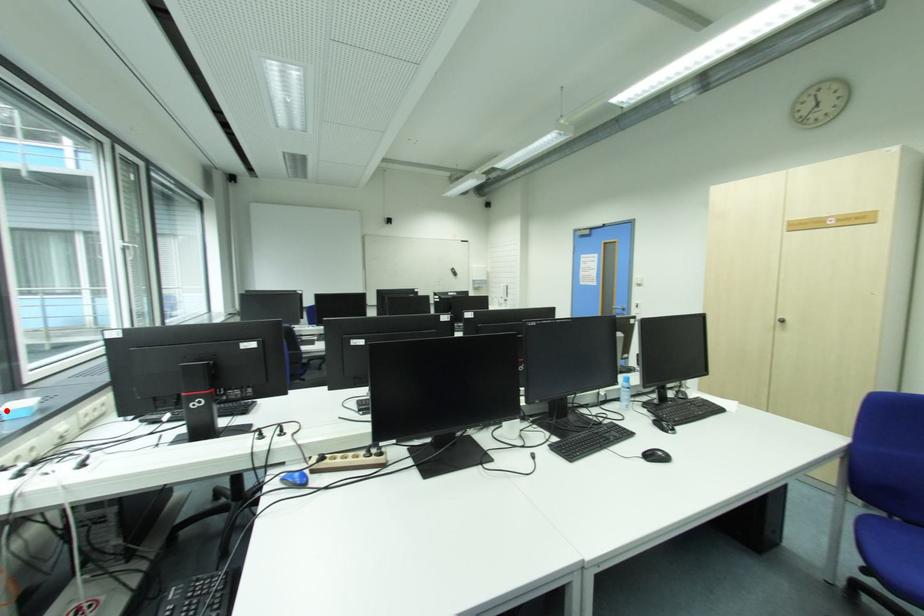
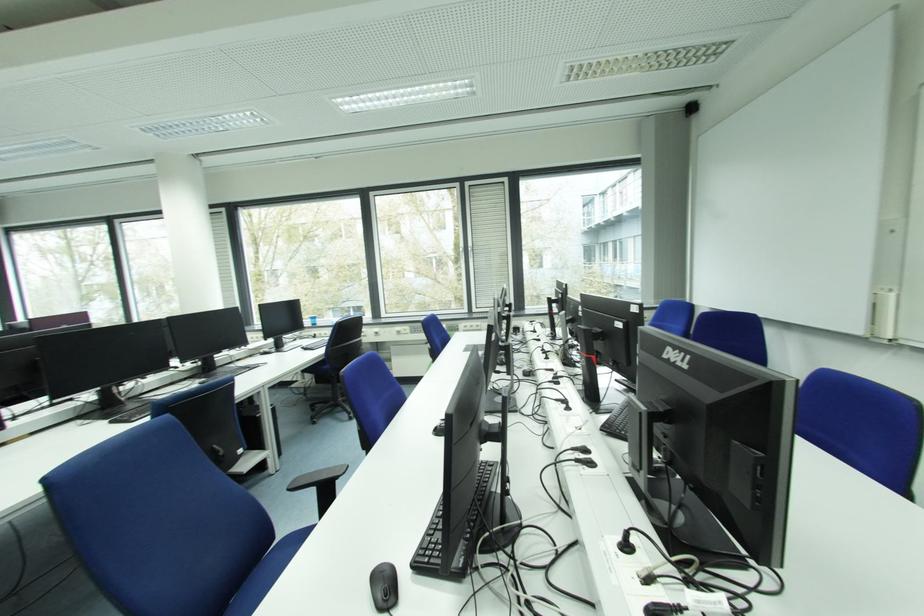
Question: I am providing you with two images of the same scene from different viewpoints. A red point is marked on the first image. At the location where the point appears in image 1, is it still visible in image 2?

Choices:
 (A) Yes
 (B) No

Answer: (B)